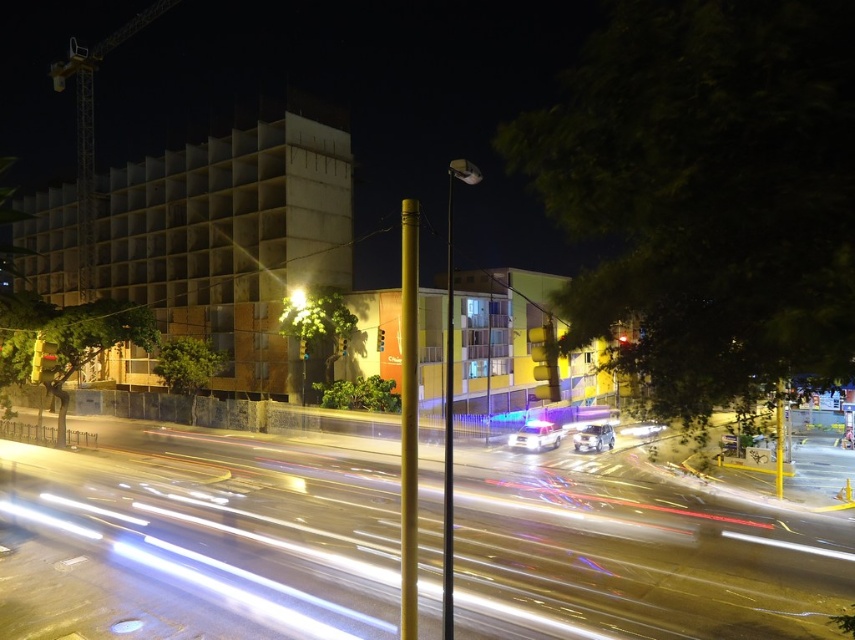
Question: Among these objects, which one is farthest from the camera?

Choices:
 (A) shiny silver car at center
 (B) matte yellow light at center
 (C) white glossy car at center

Answer: (B)

Question: Does shiny silver car at center have a smaller size compared to matte yellow light at center?

Choices:
 (A) yes
 (B) no

Answer: (B)

Question: Among these points, which one is nearest to the camera?

Choices:
 (A) (299, 298)
 (B) (588, 424)

Answer: (B)

Question: Does white glossy car at center have a lesser width compared to matte yellow light at center?

Choices:
 (A) no
 (B) yes

Answer: (B)

Question: Where is shiny silver car at center located in relation to matte yellow light at center in the image?

Choices:
 (A) below
 (B) above

Answer: (A)

Question: Estimate the real-world distances between objects in this image. Which object is farther from the shiny silver car at center?

Choices:
 (A) matte yellow light at center
 (B) white glossy car at center

Answer: (A)